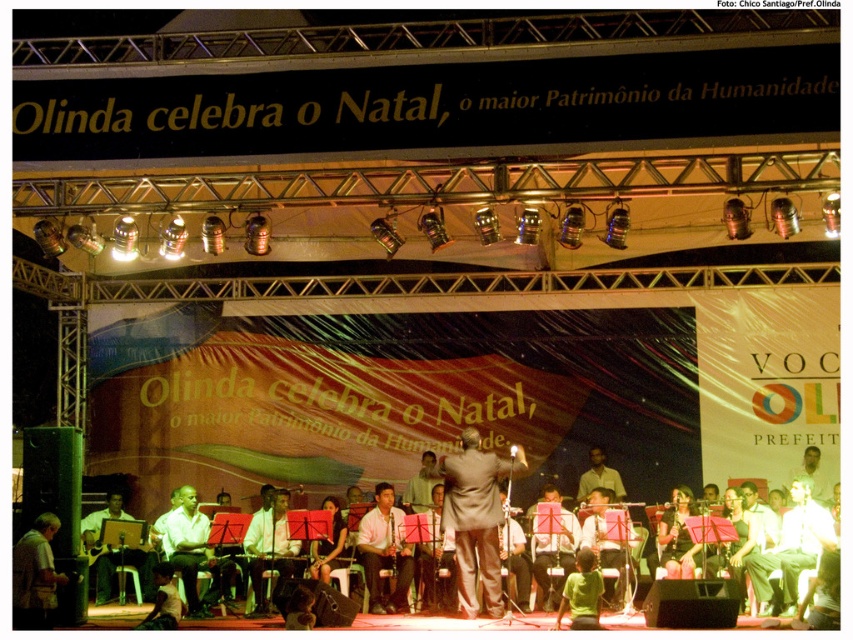
Question: Is dark gray suit at center to the right of light brown wood drum at center from the viewer's perspective?

Choices:
 (A) yes
 (B) no

Answer: (A)

Question: Does dark gray suit at center come behind light brown wood chair at lower left?

Choices:
 (A) yes
 (B) no

Answer: (B)

Question: Does dark gray suit at center have a larger size compared to smooth brown saxophone at center?

Choices:
 (A) no
 (B) yes

Answer: (B)

Question: Which point is farther to the camera?

Choices:
 (A) (469, 472)
 (B) (386, 557)

Answer: (B)

Question: Which point is closer to the camera?

Choices:
 (A) (456, 544)
 (B) (280, 579)

Answer: (A)

Question: Which point is closer to the camera taking this photo?

Choices:
 (A) (247, 528)
 (B) (500, 461)

Answer: (B)